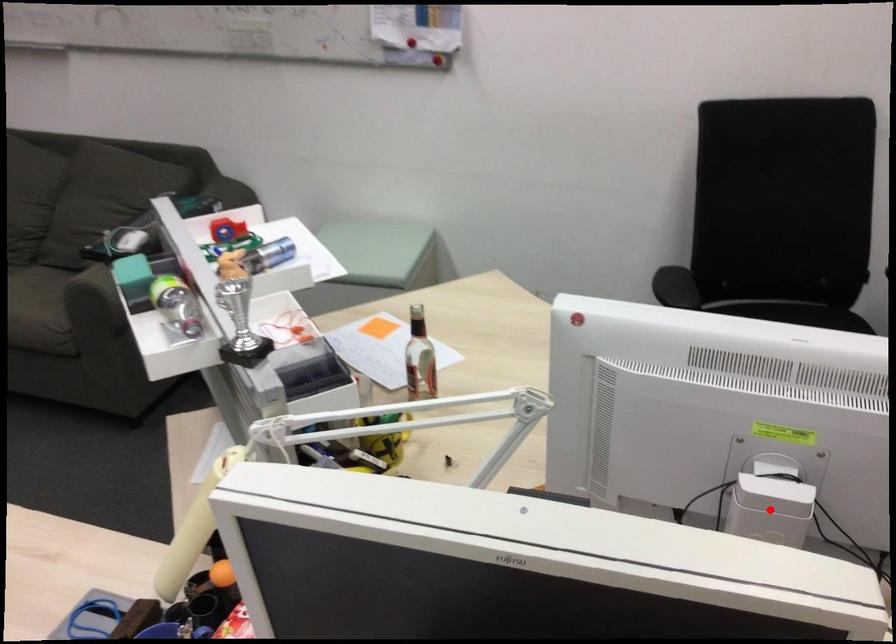
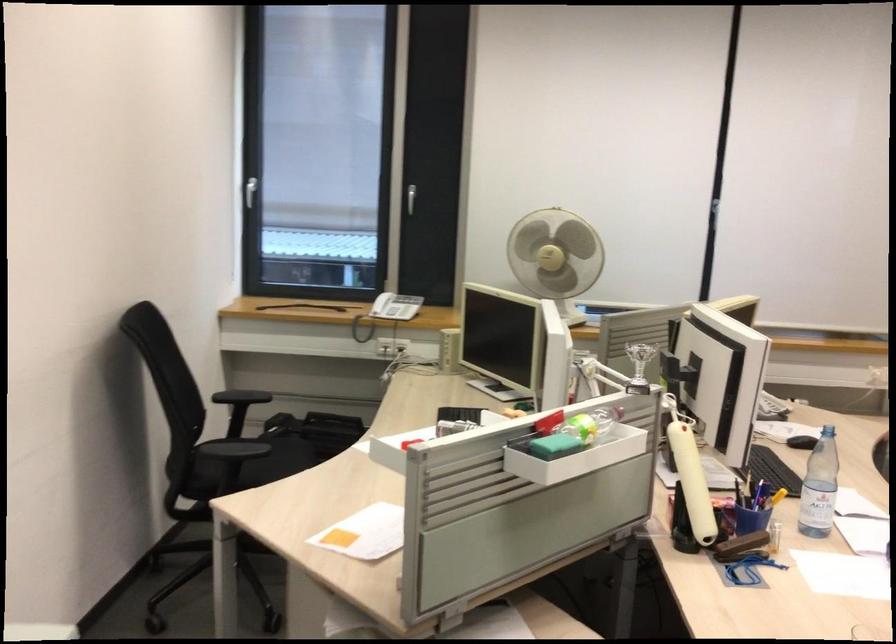
Question: I am providing you with two images of the same scene from different viewpoints. A red point is marked on the first image. Can you still see the location of the red point in image 2?

Choices:
 (A) Yes
 (B) No

Answer: (B)